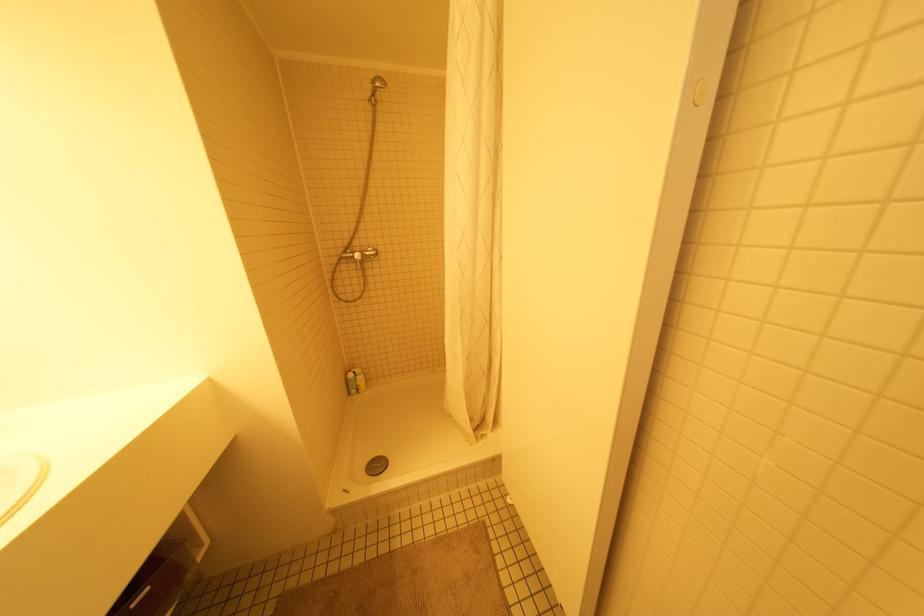
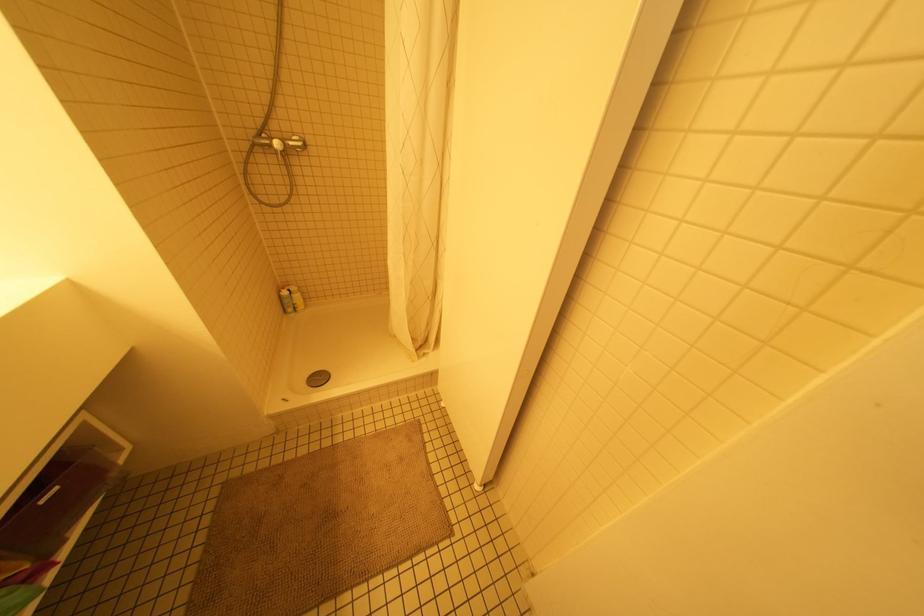
Locate, in the second image, the point that corresponds to point (359, 378) in the first image.

(297, 296)